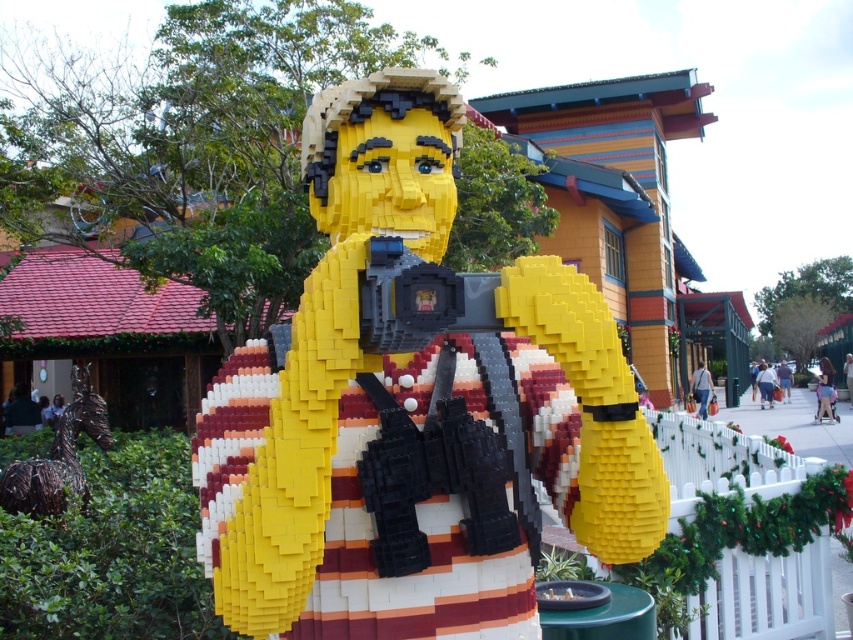
You are a photographer setting up for a photo shoot. You need to ensure that the yellow matte lego figure at center and the bronze horse at lower left are both visible in the frame. Given their sizes, which object should you position closer to the camera to maintain their visibility in the photo?

The bronze horse at lower left should be positioned closer to the camera since the yellow matte lego figure at center is much taller than the bronze horse at lower left. This way, both objects will appear more balanced in size within the frame.

You are a tour guide leading a group to a LEGO sculpture. You want to point out the two specific points on the image. The first point is at coordinate point (531, 308) and the second point is at coordinate point (90, 426). Which point is closer to the front of the image?

Point (531, 308) is in front of point (90, 426), so the first point is closer to the front of the image.